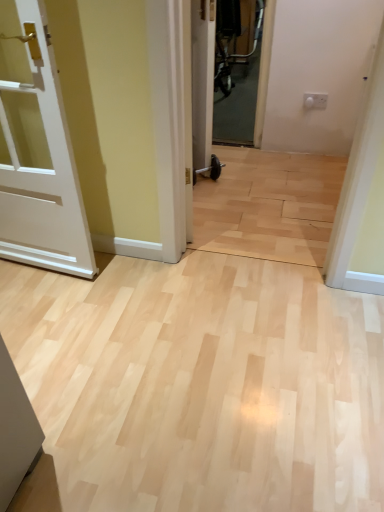
This screenshot has height=512, width=384. I want to click on vacant point to the left of white matte door at left, which is the 1th door from bottom to top, so click(x=25, y=306).